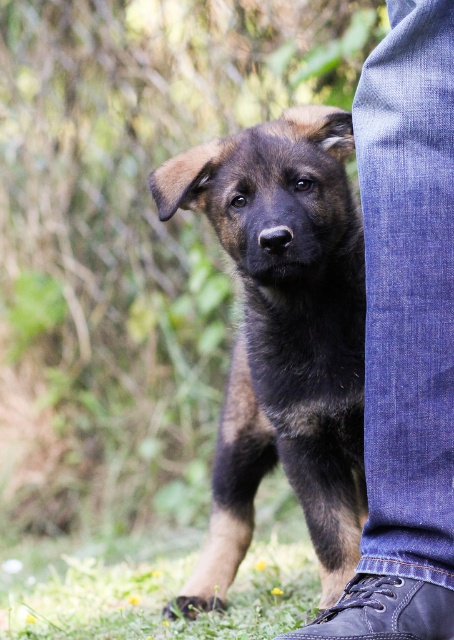
Question: Estimate the real-world distances between objects in this image. Which object is closer to the brown fur puppy at center?

Choices:
 (A) green grass at lower center
 (B) denim pants at lower right
 (C) leather shoe at lower center

Answer: (B)

Question: Is brown fur puppy at center to the left of denim pants at lower right from the viewer's perspective?

Choices:
 (A) yes
 (B) no

Answer: (A)

Question: Does brown fur puppy at center have a greater width compared to leather shoe at lower center?

Choices:
 (A) no
 (B) yes

Answer: (B)

Question: Is brown fur puppy at center in front of green grass at lower center?

Choices:
 (A) no
 (B) yes

Answer: (B)

Question: Which of the following is the farthest from the observer?

Choices:
 (A) leather shoe at lower center
 (B) green grass at lower center

Answer: (B)

Question: Estimate the real-world distances between objects in this image. Which object is closer to the brown fur puppy at center?

Choices:
 (A) green grass at lower center
 (B) leather shoe at lower center
 (C) denim pants at lower right

Answer: (C)